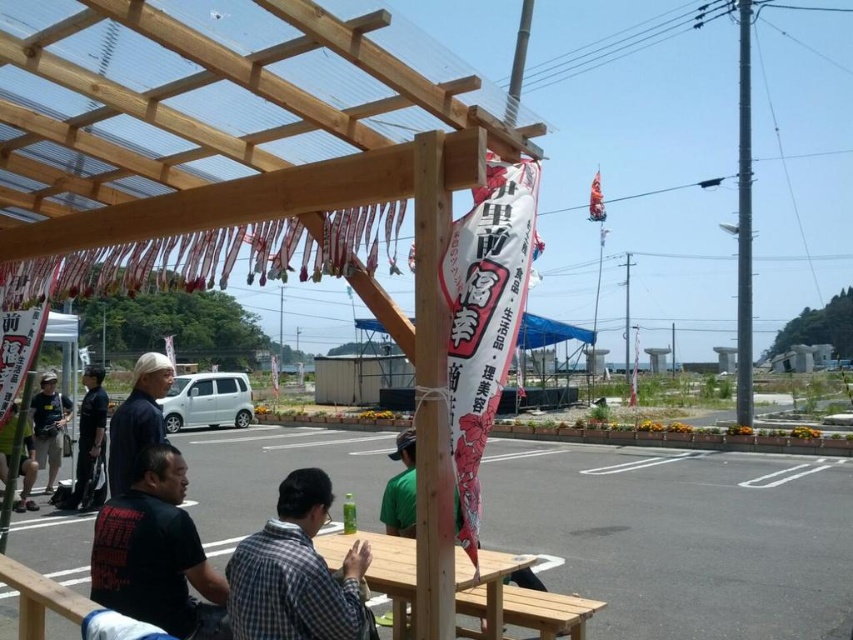
Looking at this image, you are standing at the base of the wooden pergola and want to hand a note to the person wearing the dark brown fabric cap at upper left and the green fabric shirt at center. If you can only walk straight towards the pergola, will you be able to reach both individuals without changing direction?

The dark brown fabric cap at upper left and green fabric shirt at center are 7.02 feet apart. Since you can only walk straight towards the pergola, you will be able to reach both individuals as they are positioned along your path of approach, but you will need to stop at two different points to hand each note individually.

Where is the dark brown fabric cap at upper left located in the image?

The dark brown fabric cap at upper left is located at point (137, 419) in the image.